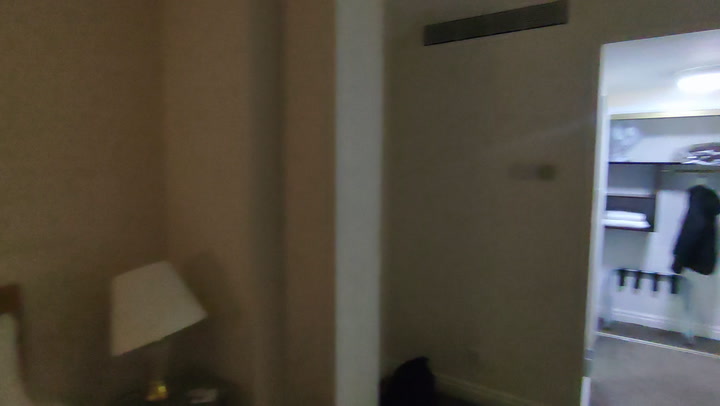
This screenshot has height=406, width=720. In order to click on white lampshade in this screenshot , I will do `click(139, 300)`.